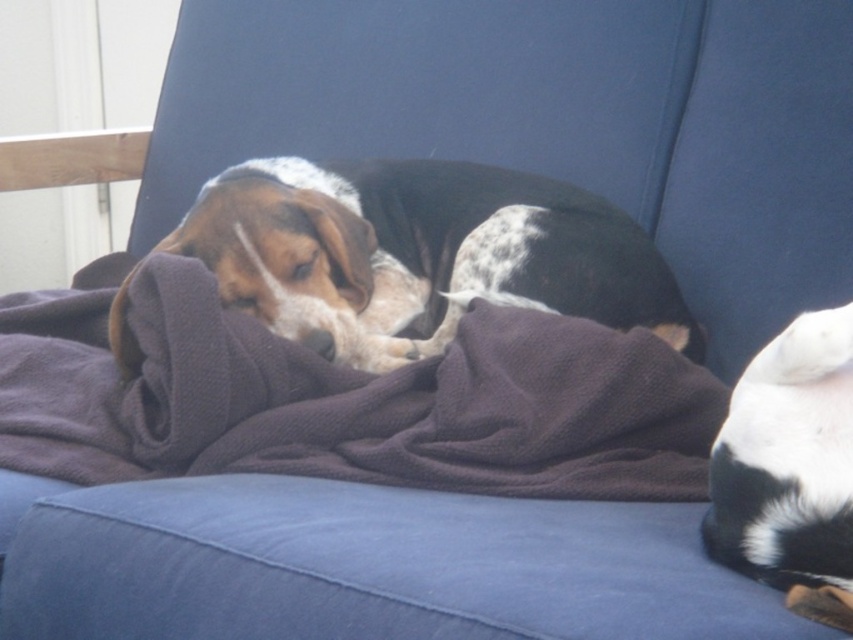
Is brown and white fur dog at center to the right of white soft fur at lower right from the viewer's perspective?

In fact, brown and white fur dog at center is to the left of white soft fur at lower right.

Is brown and white fur dog at center thinner than white soft fur at lower right?

In fact, brown and white fur dog at center might be wider than white soft fur at lower right.

Who is more forward, [332,257] or [838,467]?

Positioned in front is point [838,467].

The width and height of the screenshot is (853, 640). Identify the location of brown and white fur dog at center. (419, 253).

From the picture: Can you confirm if brown cotton blanket at center is positioned below brown and white fur dog at center?

Yes, brown cotton blanket at center is below brown and white fur dog at center.

What do you see at coordinates (345, 397) in the screenshot? I see `brown cotton blanket at center` at bounding box center [345, 397].

Locate an element on the screen. brown cotton blanket at center is located at coordinates (345, 397).

Is brown cotton blanket at center in front of white soft fur at lower right?

No, brown cotton blanket at center is behind white soft fur at lower right.

This screenshot has width=853, height=640. Describe the element at coordinates (345, 397) in the screenshot. I see `brown cotton blanket at center` at that location.

From the picture: Measure the distance between brown cotton blanket at center and camera.

34.47 inches

Locate an element on the screen. brown cotton blanket at center is located at coordinates (345, 397).